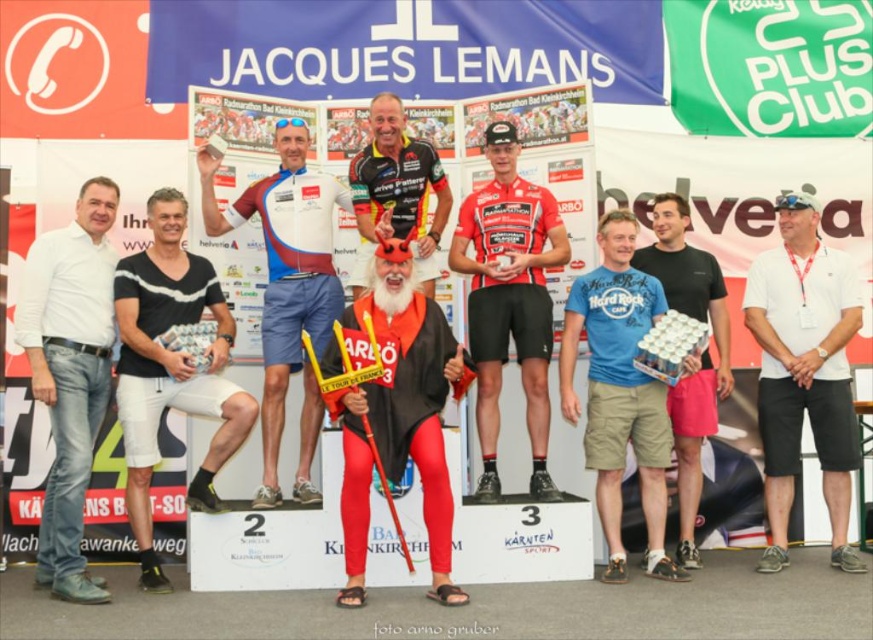
Question: Is red matte body suit at center positioned in front of black cotton shorts at center?

Choices:
 (A) no
 (B) yes

Answer: (B)

Question: Which point is closer to the camera?

Choices:
 (A) blue cotton t-shirt at center
 (B) red matte jersey at center
 (C) white cotton polo shirt at right
 (D) red matte body suit at center

Answer: (D)

Question: Which of the following is the closest to the observer?

Choices:
 (A) (610, 483)
 (B) (40, 268)
 (C) (480, 218)
 (D) (148, 440)

Answer: (D)

Question: Does black cotton shorts at center appear on the left side of blue cotton t-shirt at center?

Choices:
 (A) yes
 (B) no

Answer: (A)

Question: Can you confirm if black cotton shorts at center is positioned to the right of shiny black cycling jersey at center?

Choices:
 (A) yes
 (B) no

Answer: (B)

Question: Among these objects, which one is nearest to the camera?

Choices:
 (A) shiny black cycling jersey at center
 (B) white cotton polo shirt at right
 (C) matte blue and white cycling jersey at center

Answer: (C)